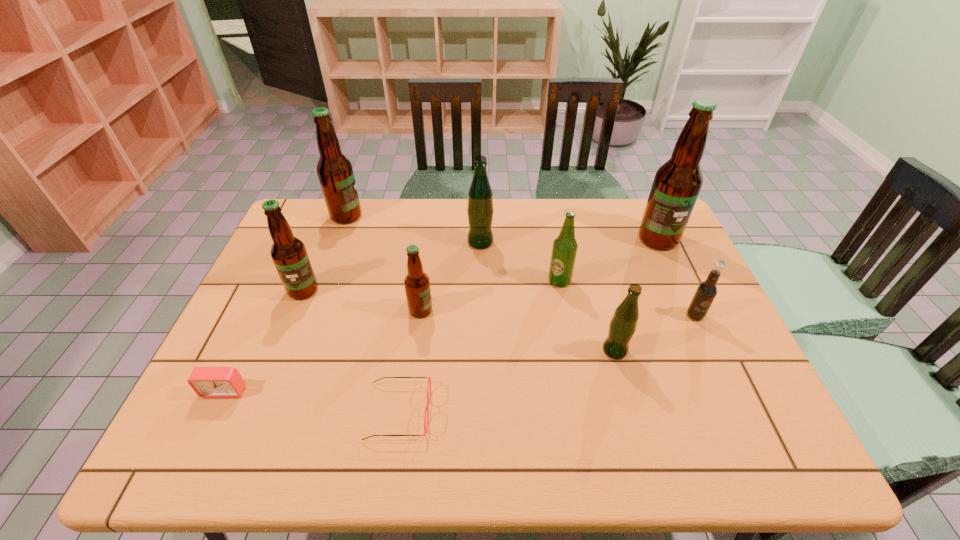
Where is `free space located 0.100m on the right of the fourth beer bottle from right to left`? The height and width of the screenshot is (540, 960). free space located 0.100m on the right of the fourth beer bottle from right to left is located at coordinates (524, 242).

Locate an element on the screen. vacant space positioned 0.400m on the label of the second smallest brown beer bottle is located at coordinates (244, 438).

This screenshot has width=960, height=540. I want to click on vacant space located 0.360m on the label of the third beer bottle from right to left, so click(582, 401).

Locate an element on the screen. free region located 0.200m on the label of the nearest brown beer bottle is located at coordinates (506, 310).

This screenshot has width=960, height=540. Identify the location of vacant space located 0.250m on the left of the nearest beer bottle. tap(503, 350).

You are a GUI agent. You are given a task and a screenshot of the screen. Output one action in this format:
    pyautogui.click(x=<x>, y=<y>)
    Task: Click on the vacant area situated 0.380m on the label of the third shortest object
    The height and width of the screenshot is (540, 960).
    Given the screenshot: What is the action you would take?
    pyautogui.click(x=763, y=464)

You are a GUI agent. You are given a task and a screenshot of the screen. Output one action in this format:
    pyautogui.click(x=<x>, y=<y>)
    Task: Click on the vacant space located 0.140m on the front-facing side of the ninth tallest object
    
    Given the screenshot: What is the action you would take?
    pyautogui.click(x=192, y=460)

The width and height of the screenshot is (960, 540). I want to click on vacant area situated 0.240m on the front-facing side of the red spectacles, so click(x=537, y=412).

The image size is (960, 540). What are the coordinates of `object that is positioned at the near edge` in the screenshot? It's located at (429, 380).

You are a GUI agent. You are given a task and a screenshot of the screen. Output one action in this format:
    pyautogui.click(x=<x>, y=<y>)
    Task: Click on the alarm clock located at the left edge
    
    Given the screenshot: What is the action you would take?
    pyautogui.click(x=208, y=382)